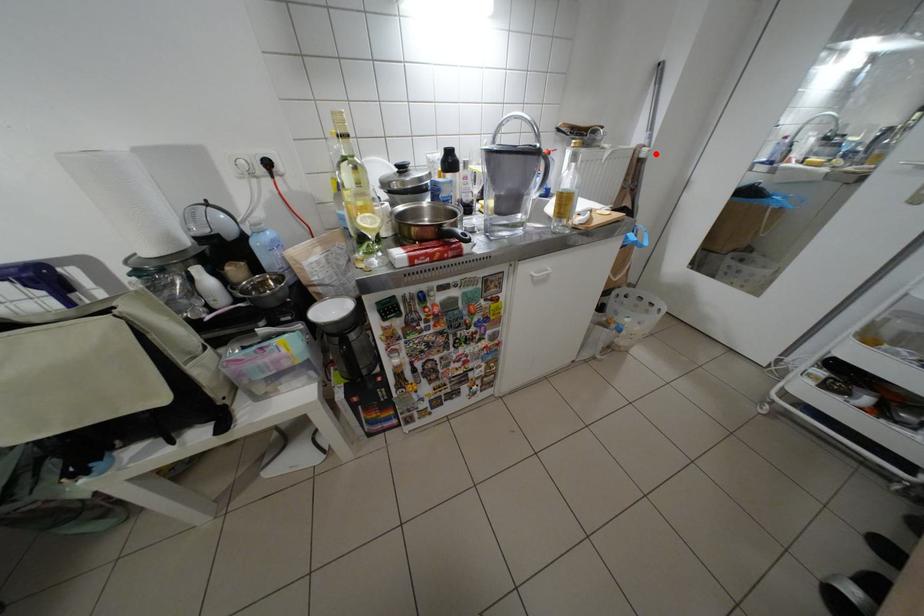
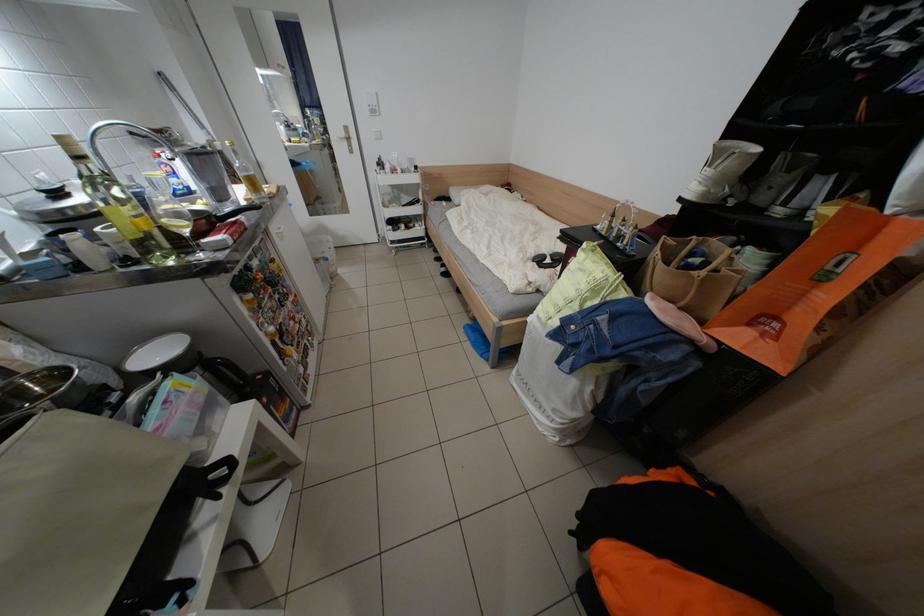
The point at the highlighted location is marked in the first image. Where is the corresponding point in the second image?

(231, 148)